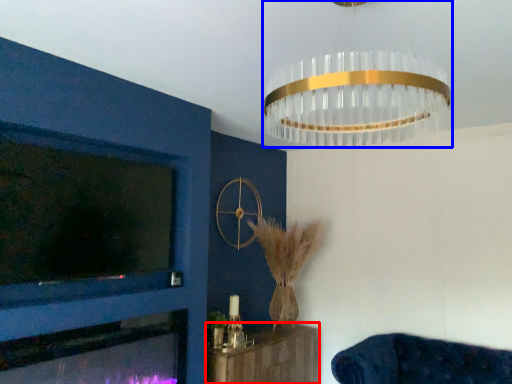
Question: Which of the following is the farthest to the observer, furniture (highlighted by a red box) or lamp (highlighted by a blue box)?

Choices:
 (A) furniture
 (B) lamp

Answer: (A)